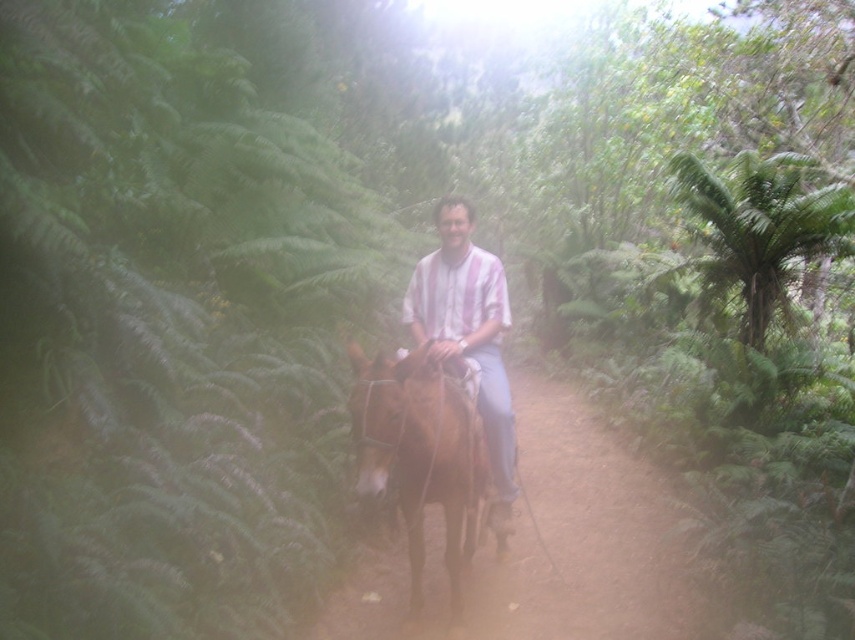
Is brown glossy horse at center taller than matte striped shirt at center?

No, brown glossy horse at center is not taller than matte striped shirt at center.

Is brown glossy horse at center bigger than matte striped shirt at center?

Incorrect, brown glossy horse at center is not larger than matte striped shirt at center.

The height and width of the screenshot is (640, 855). I want to click on brown glossy horse at center, so pos(420,456).